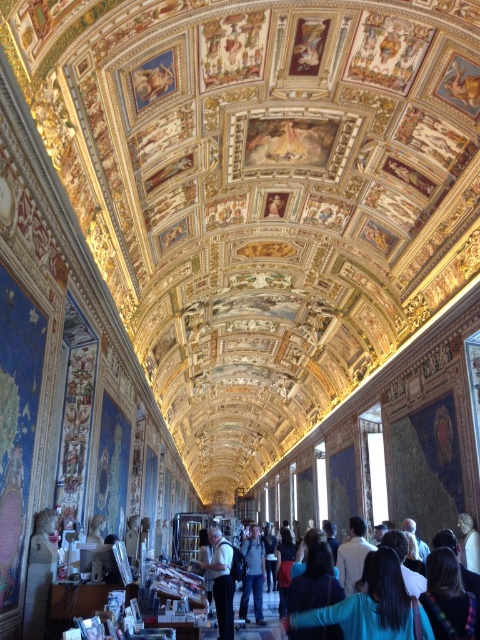
Can you confirm if blue fabric at center is positioned above dark brown hair at lower right?

No, blue fabric at center is not above dark brown hair at lower right.

Between blue fabric at center and dark brown hair at lower right, which one has more height?

blue fabric at center

The width and height of the screenshot is (480, 640). I want to click on blue fabric at center, so click(372, 605).

Is point (211, 573) farther from camera compared to point (255, 593)?

That is False.

Can you confirm if dark blue shirt at center is positioned to the left of denim jacket at center?

Indeed, dark blue shirt at center is positioned on the left side of denim jacket at center.

Locate an element on the screen. This screenshot has height=640, width=480. dark blue shirt at center is located at coordinates (220, 580).

Identify the location of dark blue shirt at center. The height and width of the screenshot is (640, 480). (220, 580).

Between blue fabric at center and dark blue fabric at center, which one appears on the left side from the viewer's perspective?

Positioned to the left is dark blue fabric at center.

Does blue fabric at center have a lesser height compared to dark blue fabric at center?

Incorrect, blue fabric at center's height does not fall short of dark blue fabric at center's.

What are the coordinates of `blue fabric at center` in the screenshot? It's located at pos(372,605).